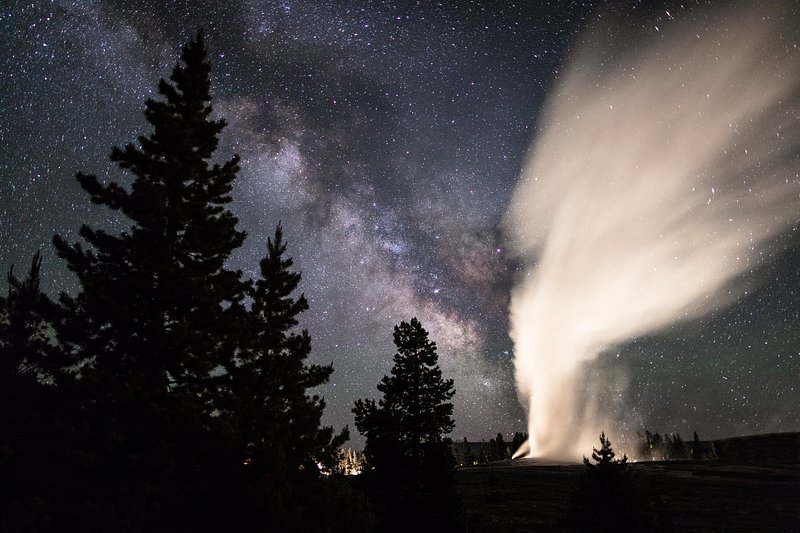
Find the location of a particular element. The width and height of the screenshot is (800, 533). top left corner empty space is located at coordinates (12, 5).